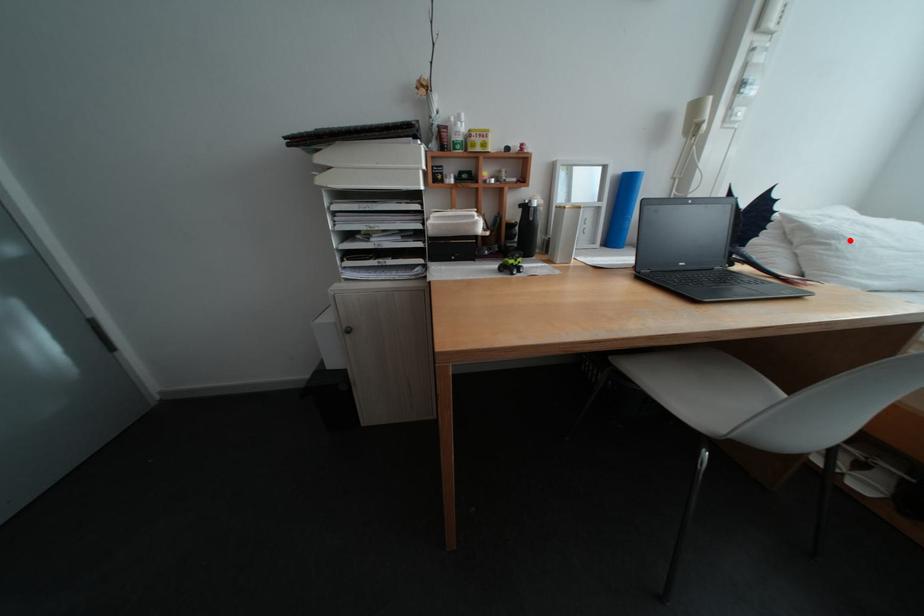
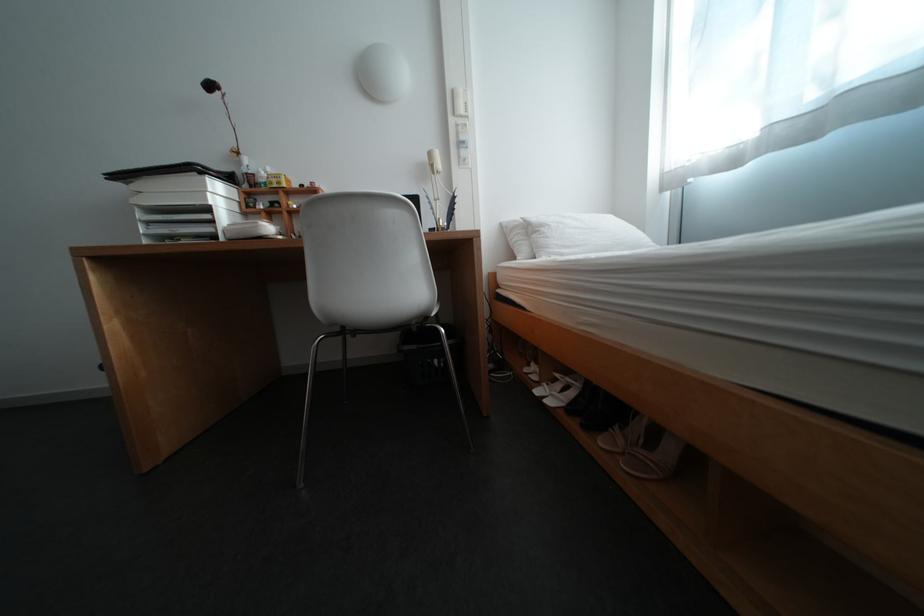
Question: I am providing you with two images of the same scene from different viewpoints. Given a red point in image1, look at the same physical point in image2. Is it:

Choices:
 (A) Closer to the viewpoint
 (B) Farther from the viewpoint

Answer: (A)